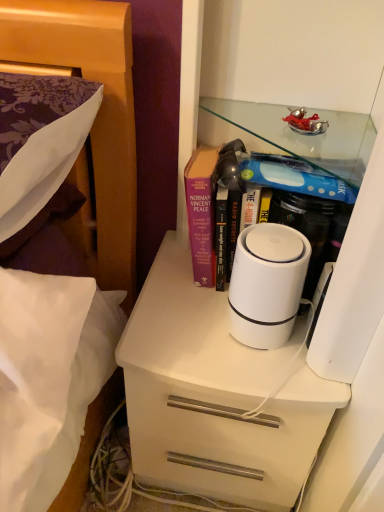
Question: From a real-world perspective, is white matte cylindrical device at center below white matte chest of drawers at center?

Choices:
 (A) no
 (B) yes

Answer: (A)

Question: Considering the relative sizes of white matte cylindrical device at center and white matte chest of drawers at center in the image provided, is white matte cylindrical device at center shorter than white matte chest of drawers at center?

Choices:
 (A) yes
 (B) no

Answer: (A)

Question: Is white matte cylindrical device at center facing away from white matte chest of drawers at center?

Choices:
 (A) yes
 (B) no

Answer: (B)

Question: Can you confirm if white matte cylindrical device at center is thinner than white matte chest of drawers at center?

Choices:
 (A) yes
 (B) no

Answer: (A)

Question: Is white matte cylindrical device at center at the left side of white matte chest of drawers at center?

Choices:
 (A) no
 (B) yes

Answer: (A)

Question: Is point (170, 440) positioned closer to the camera than point (188, 50)?

Choices:
 (A) closer
 (B) farther

Answer: (B)

Question: In the image, is white matte chest of drawers at center on the left side or the right side of white glossy cabinet at center?

Choices:
 (A) right
 (B) left

Answer: (B)

Question: Considering their positions, is white matte chest of drawers at center located in front of or behind white glossy cabinet at center?

Choices:
 (A) front
 (B) behind

Answer: (B)

Question: Looking at their shapes, would you say white matte chest of drawers at center is wider or thinner than white glossy cabinet at center?

Choices:
 (A) thin
 (B) wide

Answer: (B)

Question: Is white matte cylindrical device at center to the left or to the right of white matte chest of drawers at center in the image?

Choices:
 (A) right
 (B) left

Answer: (A)

Question: From a real-world perspective, is white matte cylindrical device at center positioned above or below white matte chest of drawers at center?

Choices:
 (A) below
 (B) above

Answer: (B)

Question: Considering their positions, is white matte cylindrical device at center located in front of or behind white matte chest of drawers at center?

Choices:
 (A) behind
 (B) front

Answer: (B)

Question: Do you think white matte cylindrical device at center is within white matte chest of drawers at center, or outside of it?

Choices:
 (A) inside
 (B) outside

Answer: (B)

Question: From their relative heights in the image, would you say white glossy cabinet at center is taller or shorter than hardcover book at center?

Choices:
 (A) tall
 (B) short

Answer: (A)

Question: Is point (362, 59) positioned closer to the camera than point (235, 146)?

Choices:
 (A) closer
 (B) farther

Answer: (A)